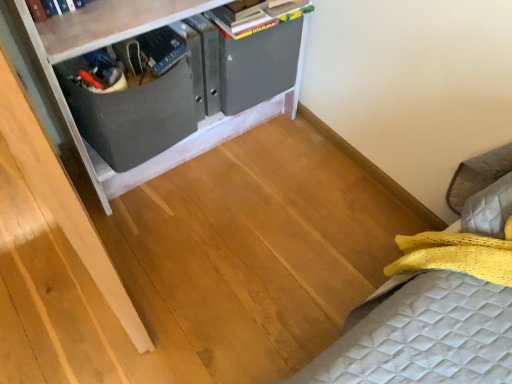
This screenshot has width=512, height=384. What do you see at coordinates (256, 15) in the screenshot? I see `hardcover book at upper center` at bounding box center [256, 15].

Where is `matte gray cabinet at upper left`? The image size is (512, 384). matte gray cabinet at upper left is located at coordinates (91, 97).

This screenshot has height=384, width=512. I want to click on matte black drawer at center, so click(x=132, y=114).

This screenshot has height=384, width=512. Identify the location of hardcover book at upper center. (256, 15).

Is matte black drawer at center located outside hardcover book at upper center?

matte black drawer at center is positioned outside hardcover book at upper center.

Is matte black drawer at center shorter than hardcover book at upper center?

In fact, matte black drawer at center may be taller than hardcover book at upper center.

Which is more to the left, matte black drawer at center or hardcover book at upper center?

matte black drawer at center.

Which point is more forward, [277,8] or [284,15]?

Positioned in front is point [277,8].

This screenshot has width=512, height=384. I want to click on book above the matte gray cabinet at upper left (from the image's perspective), so click(x=256, y=15).

Can you see hardcover book at upper center touching matte gray cabinet at upper left?

hardcover book at upper center and matte gray cabinet at upper left are clearly separated.

Which of these two, hardcover book at upper center or matte gray cabinet at upper left, is smaller?

With smaller size is hardcover book at upper center.

Is matte gray cabinet at upper left thinner than hardcover book at upper center?

In fact, matte gray cabinet at upper left might be wider than hardcover book at upper center.

Identify the location of book on the right of matte gray cabinet at upper left. The width and height of the screenshot is (512, 384). (256, 15).

From a real-world perspective, is matte gray cabinet at upper left on top of hardcover book at upper center?

Incorrect, from a real-world perspective, matte gray cabinet at upper left is lower than hardcover book at upper center.

Considering the sizes of matte black drawer at center and matte gray cabinet at upper left in the image, is matte black drawer at center wider or thinner than matte gray cabinet at upper left?

Considering their sizes, matte black drawer at center looks slimmer than matte gray cabinet at upper left.

Is matte black drawer at center taller than matte gray cabinet at upper left?

No.

This screenshot has height=384, width=512. In the image, there is a matte black drawer at center. In order to click on furniture above it (from the image's perspective) in this screenshot , I will do `click(91, 97)`.

Could you tell me if matte black drawer at center is facing matte gray cabinet at upper left?

Yes, matte black drawer at center is turned towards matte gray cabinet at upper left.

Is matte gray cabinet at upper left facing towards matte black drawer at center?

Yes, matte gray cabinet at upper left faces towards matte black drawer at center.

What's the angular difference between matte gray cabinet at upper left and matte black drawer at center's facing directions?

2.4 degrees separate the facing orientations of matte gray cabinet at upper left and matte black drawer at center.

Is matte gray cabinet at upper left positioned beyond the bounds of matte black drawer at center?

Indeed, matte gray cabinet at upper left is completely outside matte black drawer at center.

From the image's perspective, is hardcover book at upper center on top of matte black drawer at center?

Yes.

Based on the photo, does hardcover book at upper center have a greater height compared to matte black drawer at center?

In fact, hardcover book at upper center may be shorter than matte black drawer at center.

How different are the orientations of hardcover book at upper center and matte black drawer at center in degrees?

2.4 degrees separate the facing orientations of hardcover book at upper center and matte black drawer at center.

From a real-world perspective, is hardcover book at upper center positioned above or below matte black drawer at center?

Clearly, from a real-world perspective, hardcover book at upper center is above matte black drawer at center.

At what (x,y) coordinates should I click in order to perform the action: click on book that is above the matte black drawer at center (from a real-world perspective). Please return your answer as a coordinate pair (x, y). This screenshot has height=384, width=512. Looking at the image, I should click on (256, 15).

Locate an element on the screen. The image size is (512, 384). book above the matte gray cabinet at upper left (from the image's perspective) is located at coordinates (256, 15).

Estimate the real-world distances between objects in this image. Which object is further from hardcover book at upper center, matte gray cabinet at upper left or matte black drawer at center?

Among the two, matte black drawer at center is located further to hardcover book at upper center.

Looking at the image, which one is located closer to matte black drawer at center, hardcover book at upper center or matte gray cabinet at upper left?

matte gray cabinet at upper left is closer to matte black drawer at center.

Looking at the image, which one is located further to hardcover book at upper center, matte black drawer at center or matte gray cabinet at upper left?

matte black drawer at center lies further to hardcover book at upper center than the other object.

Based on their spatial positions, is hardcover book at upper center or matte black drawer at center closer to matte gray cabinet at upper left?

matte black drawer at center.

Looking at the image, which one is located closer to matte black drawer at center, matte gray cabinet at upper left or hardcover book at upper center?

The object closer to matte black drawer at center is matte gray cabinet at upper left.

Looking at the image, which one is located further to matte gray cabinet at upper left, matte black drawer at center or hardcover book at upper center?

hardcover book at upper center is further to matte gray cabinet at upper left.

The image size is (512, 384). I want to click on furniture between matte black drawer at center and hardcover book at upper center in the horizontal direction, so click(x=91, y=97).